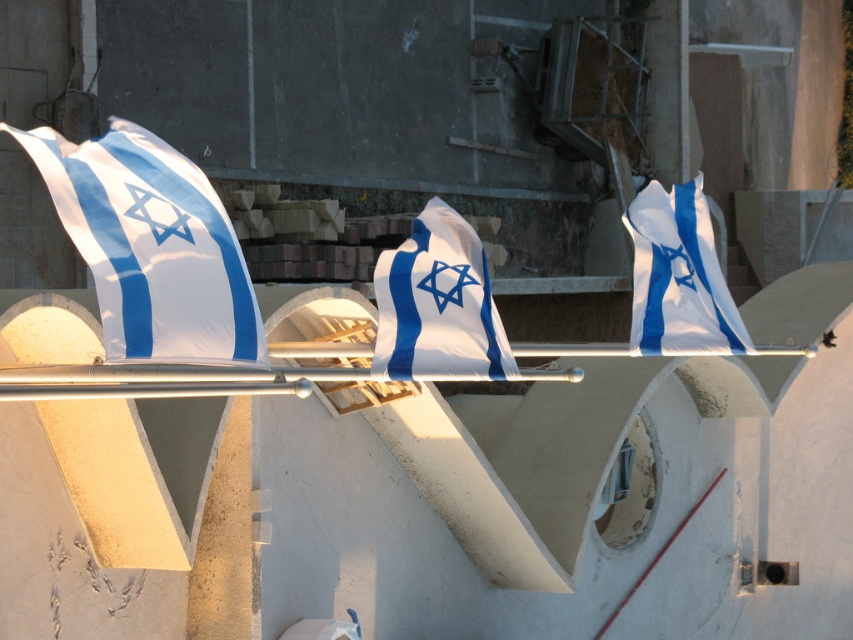
You are an observer standing in front of the construction site. You notice two flags, the white fabric flag at center and the white fabric flag at right. Which flag is located to the left of the other?

The white fabric flag at center is positioned on the left side of the white fabric flag at right.

You are a construction worker who needs to ensure all flags are the same size for a ceremony. Looking at the white fabric flag at left and the white fabric flag at center, which one is taller?

The white fabric flag at left is taller than the white fabric flag at center.